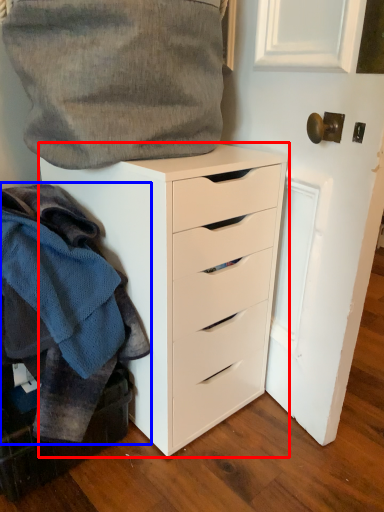
Question: Which point is closer to the camera, chest of drawers (highlighted by a red box) or clothing (highlighted by a blue box)?

Choices:
 (A) chest of drawers
 (B) clothing

Answer: (B)